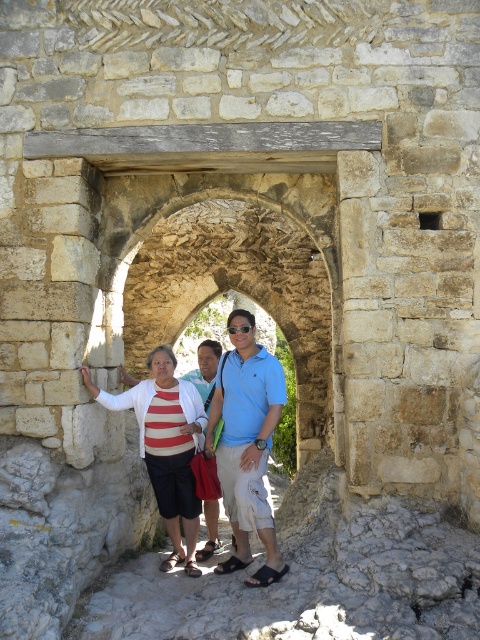
You are a photographer trying to ensure that all subjects in the photo are visible. The striped fabric sweater at center and the blue cotton polo shirt at center are both worn by people standing in the same spot. If you want to avoid overlapping their arms, which person should move to the side?

The striped fabric sweater at center should move to the side because it is wider than the blue cotton polo shirt at center, so there is less space between them when they stand close.

You are standing in front of the ancient stone archway and notice two points marked on the structure. The first point is at coordinates point (240, 506) and the second is at point (219, 468). Which of these two points is closer to your current position?

Point (240, 506) is closer to the viewer than point (219, 468).

You are a photographer trying to adjust the lighting for a group photo. The subjects are wearing a striped fabric sweater at center and a blue cotton polo shirt at center. Which clothing item is positioned higher on the person, and therefore might require more lighting adjustment?

The striped fabric sweater at center is taller than the blue cotton polo shirt at center, so it is positioned higher and may require more lighting adjustment.